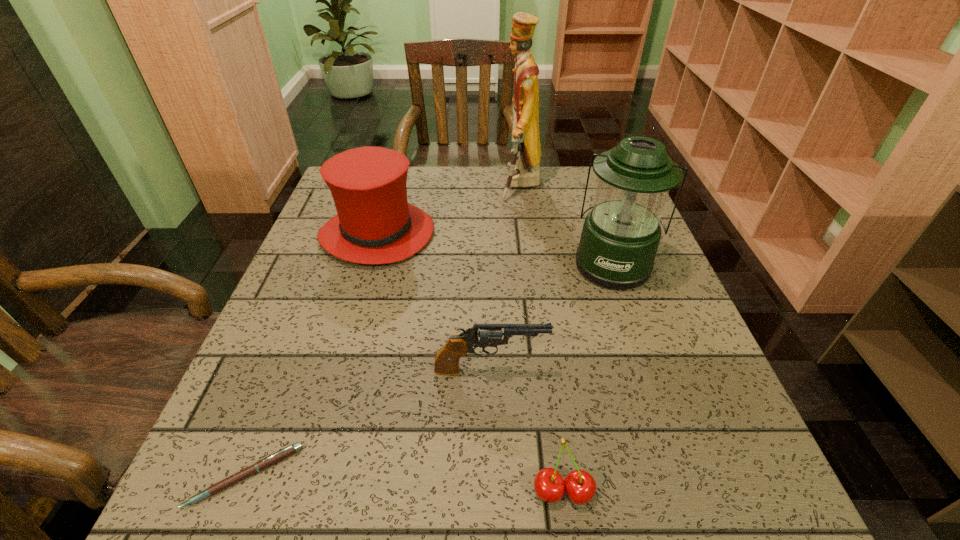
Locate an element on the screen. blank space located on the left of the fifth shortest object is located at coordinates (478, 264).

Find the location of `vacant space located 0.140m on the back of the fourth shortest object`. vacant space located 0.140m on the back of the fourth shortest object is located at coordinates (394, 178).

You are a GUI agent. You are given a task and a screenshot of the screen. Output one action in this format:
    pyautogui.click(x=<x>, y=<y>)
    Task: Click on the free space located along the barrel of the gun
    The height and width of the screenshot is (540, 960).
    Given the screenshot: What is the action you would take?
    pyautogui.click(x=652, y=370)

Find the location of a particular element. Image resolution: width=960 pixels, height=540 pixels. nutcracker located at the far edge is located at coordinates (524, 166).

The height and width of the screenshot is (540, 960). In order to click on hat located at the far edge in this screenshot , I will do `click(375, 224)`.

Identify the location of cherry at the near edge. (580, 486).

Where is `pen situated at the near edge`? pen situated at the near edge is located at coordinates 268,461.

Locate an element on the screen. This screenshot has height=540, width=960. hat located in the left edge section of the desktop is located at coordinates (375, 224).

Locate an element on the screen. This screenshot has height=540, width=960. pen that is positioned at the left edge is located at coordinates (268, 461).

At what (x,y) coordinates should I click in order to perform the action: click on object that is positioned at the right edge. Please return your answer as a coordinate pair (x, y). Image resolution: width=960 pixels, height=540 pixels. Looking at the image, I should click on (620, 237).